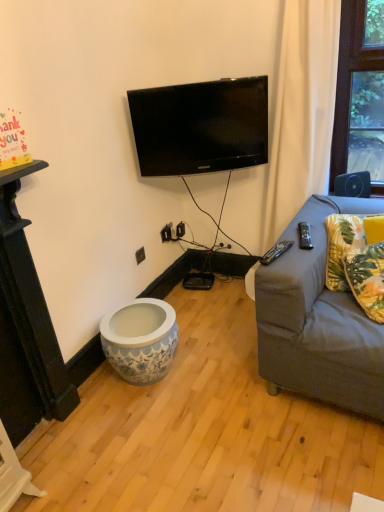
Question: Should I look upward or downward to see yellow floral fabric pillow at right, arranged as the first pillow when viewed from the front?

Choices:
 (A) down
 (B) up

Answer: (A)

Question: Is black plastic outlet at lower center at the left side of yellow fabric pillow at right, the second pillow viewed from the front?

Choices:
 (A) yes
 (B) no

Answer: (A)

Question: Is black plastic outlet at lower center not close to yellow fabric pillow at right, the 1th pillow from the back?

Choices:
 (A) yes
 (B) no

Answer: (A)

Question: From a real-world perspective, does black plastic outlet at lower center stand above yellow fabric pillow at right, the second pillow viewed from the front?

Choices:
 (A) yes
 (B) no

Answer: (B)

Question: Does black plastic outlet at lower center come in front of yellow fabric pillow at right, the second pillow viewed from the front?

Choices:
 (A) yes
 (B) no

Answer: (B)

Question: Is yellow fabric pillow at right, the 1th pillow from the back, located within black plastic outlet at lower center?

Choices:
 (A) no
 (B) yes

Answer: (A)

Question: Does black plastic outlet at lower center come behind yellow fabric pillow at right, the second pillow viewed from the front?

Choices:
 (A) no
 (B) yes

Answer: (B)

Question: Does black plastic outlet at lower center turn towards yellow floral fabric pillow at right, acting as the second pillow starting from the back?

Choices:
 (A) yes
 (B) no

Answer: (A)

Question: Considering the relative positions of black plastic outlet at lower center and yellow floral fabric pillow at right, arranged as the first pillow when viewed from the front, in the image provided, is black plastic outlet at lower center to the right of yellow floral fabric pillow at right, arranged as the first pillow when viewed from the front, from the viewer's perspective?

Choices:
 (A) yes
 (B) no

Answer: (B)

Question: Is black plastic outlet at lower center further to camera compared to yellow floral fabric pillow at right, arranged as the first pillow when viewed from the front?

Choices:
 (A) no
 (B) yes

Answer: (B)

Question: Does black plastic outlet at lower center have a lesser width compared to yellow floral fabric pillow at right, acting as the second pillow starting from the back?

Choices:
 (A) no
 (B) yes

Answer: (B)

Question: Can you confirm if black plastic outlet at lower center is taller than yellow floral fabric pillow at right, acting as the second pillow starting from the back?

Choices:
 (A) yes
 (B) no

Answer: (B)

Question: Is yellow floral fabric pillow at right, acting as the second pillow starting from the back, completely or partially inside black plastic outlet at lower center?

Choices:
 (A) yes
 (B) no

Answer: (B)

Question: Is the position of yellow floral fabric pillow at right, acting as the second pillow starting from the back, more distant than that of black plastic outlet at lower center?

Choices:
 (A) no
 (B) yes

Answer: (A)